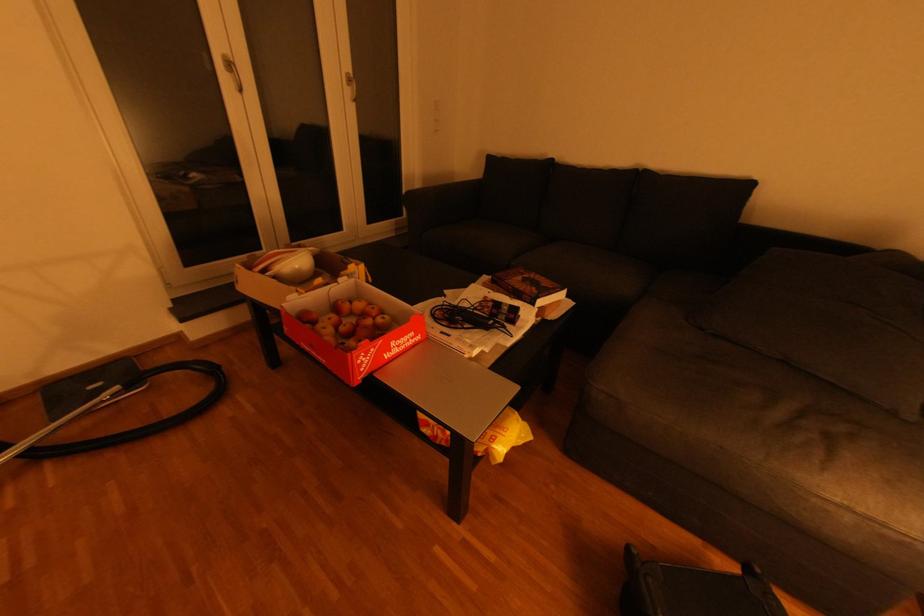
What do you see at coordinates (446, 200) in the screenshot?
I see `the sofa armrest` at bounding box center [446, 200].